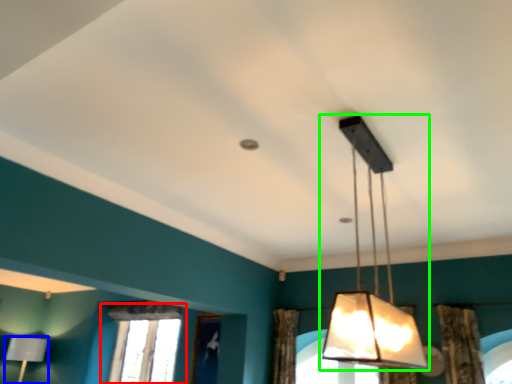
Question: Which is farther away from window (highlighted by a red box)? lamp (highlighted by a blue box) or lamp (highlighted by a green box)?

Choices:
 (A) lamp
 (B) lamp

Answer: (B)